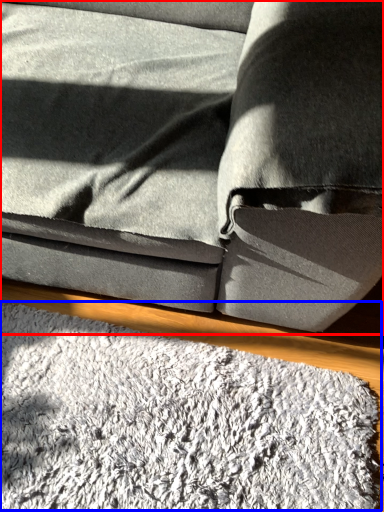
Question: Which of the following is the farthest to the observer, studio couch (highlighted by a red box) or mat (highlighted by a blue box)?

Choices:
 (A) studio couch
 (B) mat

Answer: (B)